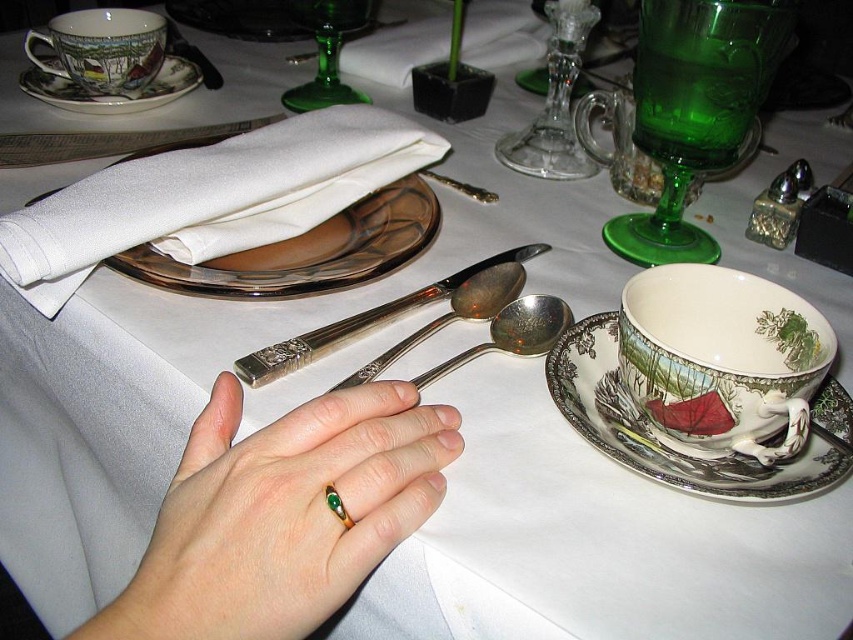
Can you confirm if porcelain cup at right is positioned to the right of porcelain saucer at upper left?

Yes, porcelain cup at right is to the right of porcelain saucer at upper left.

Can you confirm if porcelain cup at right is positioned to the left of porcelain saucer at upper left?

No, porcelain cup at right is not to the left of porcelain saucer at upper left.

This screenshot has height=640, width=853. Describe the element at coordinates (721, 358) in the screenshot. I see `porcelain cup at right` at that location.

Identify the location of porcelain cup at right. (721, 358).

Is point (354, 452) farther from viewer compared to point (186, 76)?

No, it is in front of (186, 76).

Image resolution: width=853 pixels, height=640 pixels. What do you see at coordinates (283, 513) in the screenshot?
I see `gold/green ring at center` at bounding box center [283, 513].

The height and width of the screenshot is (640, 853). Identify the location of gold/green ring at center. (283, 513).

Is matte porcelain teacup at upper left positioned behind silver/glossy spoon at center?

Yes.

Who is lower down, matte porcelain teacup at upper left or silver/glossy spoon at center?

silver/glossy spoon at center is lower down.

This screenshot has width=853, height=640. What do you see at coordinates (103, 49) in the screenshot?
I see `matte porcelain teacup at upper left` at bounding box center [103, 49].

At what (x,y) coordinates should I click in order to perform the action: click on matte porcelain teacup at upper left. Please return your answer as a coordinate pair (x, y). This screenshot has width=853, height=640. Looking at the image, I should click on click(x=103, y=49).